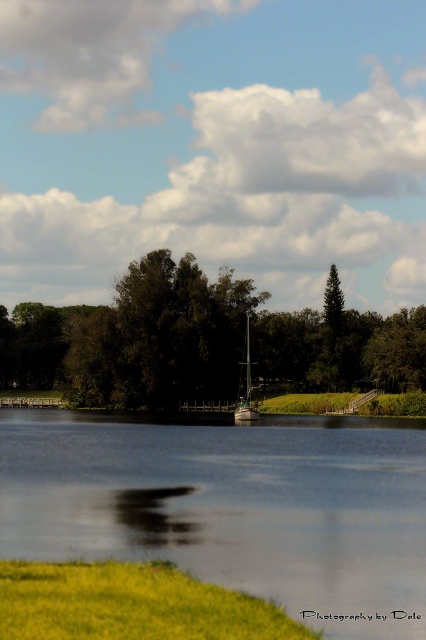
You are standing at the edge of the lake and want to locate the smooth water at center. According to the coordinates provided, where would you find it?

The smooth water at center is located at the coordinates point (233,508).

You are standing on the wooden pier and want to reach the smooth water at center. Which direction should you go relative to the green leafy tree at center?

The smooth water at center is positioned on the right side of green leafy tree at center, so you should go to the right of the green leafy tree at center to reach the smooth water at center.